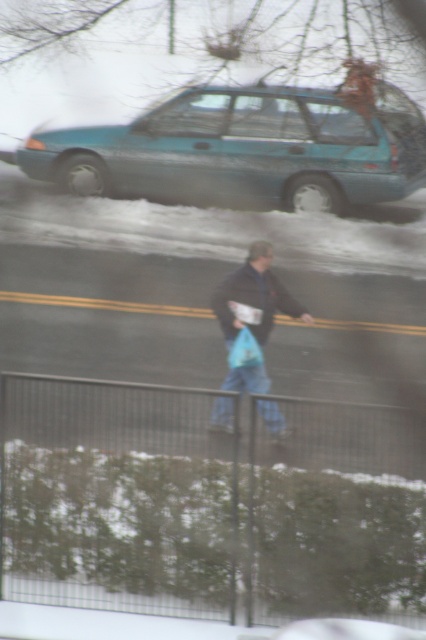
Does metallic wire fence at lower center have a larger size compared to blue denim jeans at center?

Correct, metallic wire fence at lower center is larger in size than blue denim jeans at center.

Consider the image. Does metallic wire fence at lower center come behind blue denim jeans at center?

That is False.

You are a GUI agent. You are given a task and a screenshot of the screen. Output one action in this format:
    pyautogui.click(x=<x>, y=<y>)
    Task: Click on the metallic wire fence at lower center
    The image size is (426, 640).
    Given the screenshot: What is the action you would take?
    pyautogui.click(x=207, y=502)

Which is behind, point (393, 198) or point (244, 374)?

Point (393, 198)

Can you confirm if teal matte station wagon at upper center is positioned above blue denim jeans at center?

Correct, teal matte station wagon at upper center is located above blue denim jeans at center.

Does point (40, 148) come farther from viewer compared to point (264, 385)?

That is True.

You are a GUI agent. You are given a task and a screenshot of the screen. Output one action in this format:
    pyautogui.click(x=<x>, y=<y>)
    Task: Click on the teal matte station wagon at upper center
    The width and height of the screenshot is (426, 640).
    Given the screenshot: What is the action you would take?
    pyautogui.click(x=244, y=150)

From the picture: Between metallic wire fence at lower center and teal matte station wagon at upper center, which one has less height?

metallic wire fence at lower center

Who is positioned more to the left, metallic wire fence at lower center or teal matte station wagon at upper center?

Positioned to the left is metallic wire fence at lower center.

Between point (6, 460) and point (256, 156), which one is positioned behind?

The point (256, 156) is behind.

I want to click on metallic wire fence at lower center, so click(x=207, y=502).